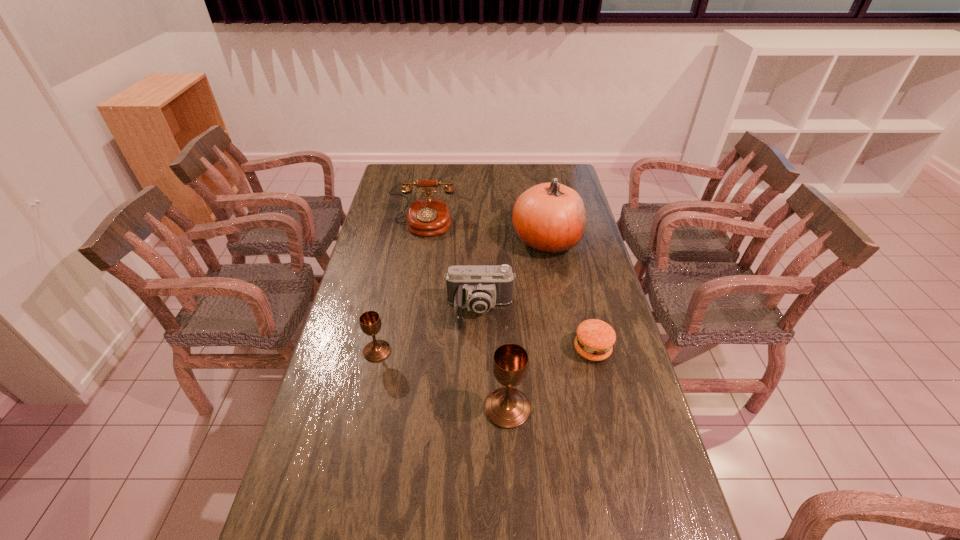
Identify the location of vacant space situated on the back of the tallest object. (540, 211).

What are the coordinates of `vacant space located on the dial of the telephone` in the screenshot? It's located at (413, 286).

The width and height of the screenshot is (960, 540). What are the coordinates of `vacant space located 0.310m on the left of the shortest object` in the screenshot? It's located at (473, 349).

Where is `vacant space located at the front of the camera with an open lens cover`? vacant space located at the front of the camera with an open lens cover is located at coordinates (480, 405).

Where is `chalice that is at the left edge`? This screenshot has width=960, height=540. chalice that is at the left edge is located at coordinates (370, 323).

This screenshot has height=540, width=960. Identify the location of telephone present at the left edge. (429, 216).

The height and width of the screenshot is (540, 960). I want to click on pumpkin that is at the right edge, so click(x=550, y=218).

This screenshot has width=960, height=540. Find the location of `patty at the right edge`. patty at the right edge is located at coordinates (595, 338).

Identify the location of free point at the far edge. (465, 164).

The image size is (960, 540). In the image, there is a desktop. In order to click on vacant space at the left edge in this screenshot , I will do `click(390, 202)`.